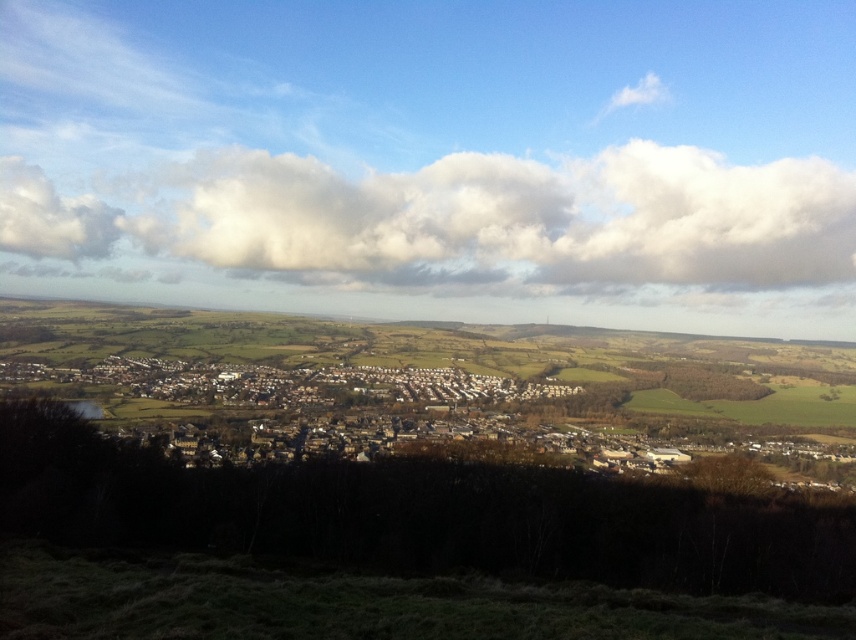
Question: Is white fluffy cloud at upper center below white matte buildings at center?

Choices:
 (A) no
 (B) yes

Answer: (A)

Question: Among these points, which one is farthest from the camera?

Choices:
 (A) (730, 403)
 (B) (131, 243)

Answer: (B)

Question: Does white fluffy cloud at upper center lie in front of white matte buildings at center?

Choices:
 (A) yes
 (B) no

Answer: (B)

Question: Is white fluffy cloud at upper center bigger than white matte buildings at center?

Choices:
 (A) yes
 (B) no

Answer: (B)